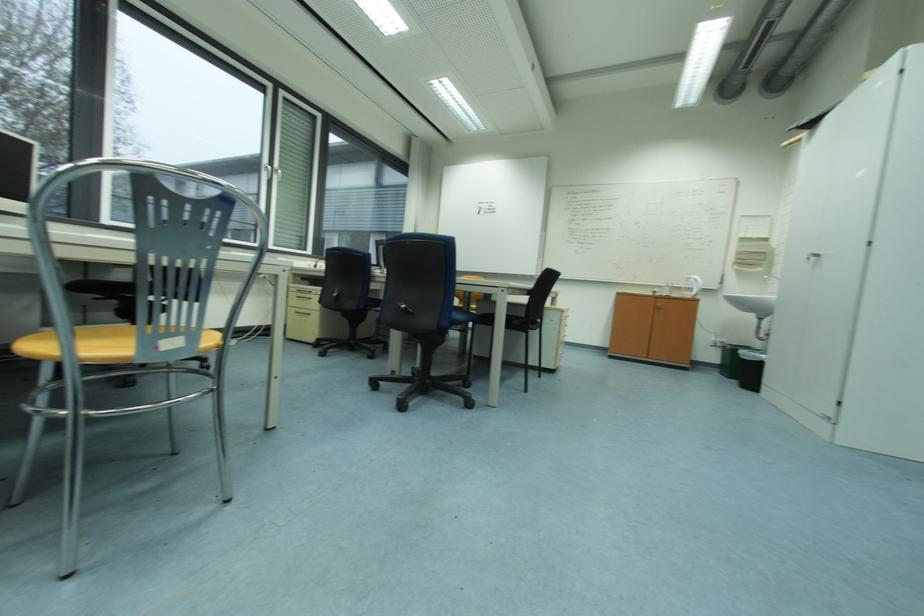
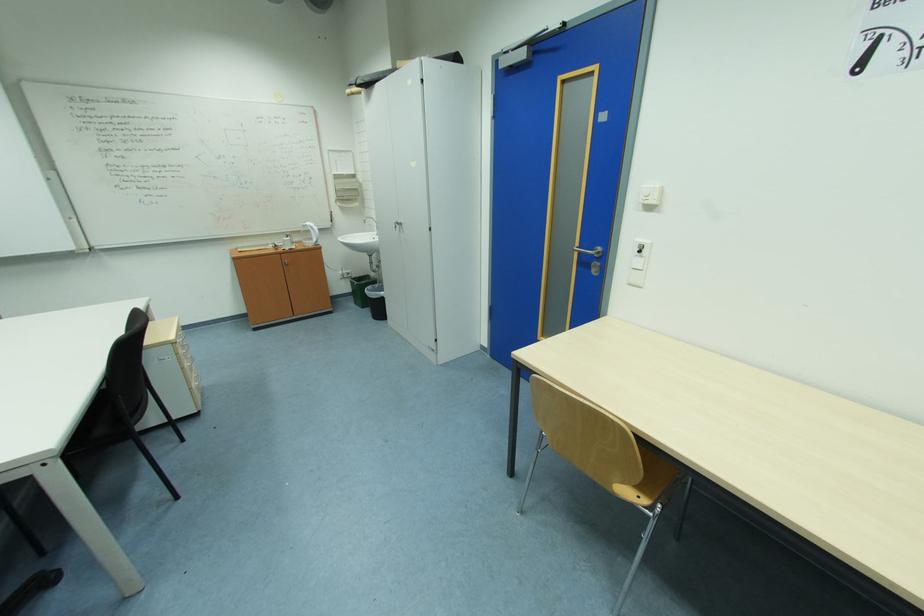
Where in the second image is the point corresponding to the point at 817,260 from the first image?

(403, 228)